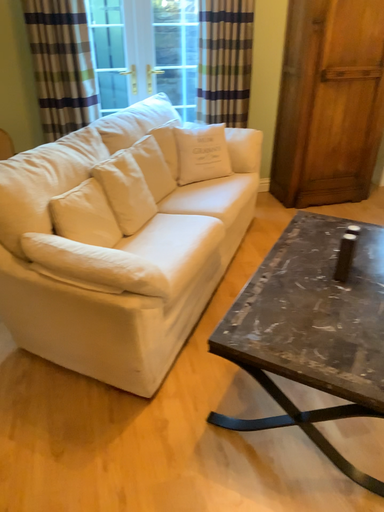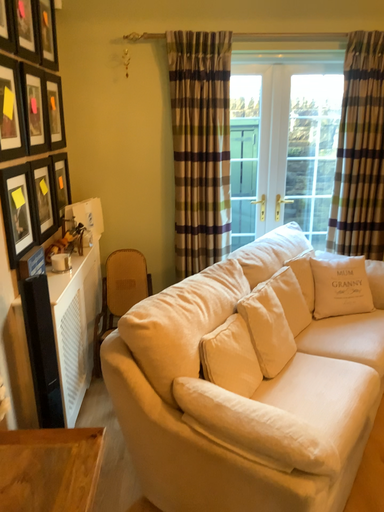
Question: Which way did the camera rotate in the video?

Choices:
 (A) rotated upward
 (B) rotated downward

Answer: (A)